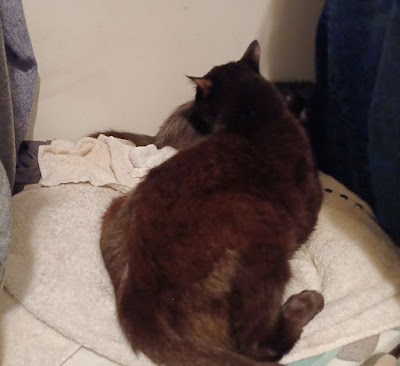
Locate an element on the screen. The width and height of the screenshot is (400, 366). towel is located at coordinates (346, 252).